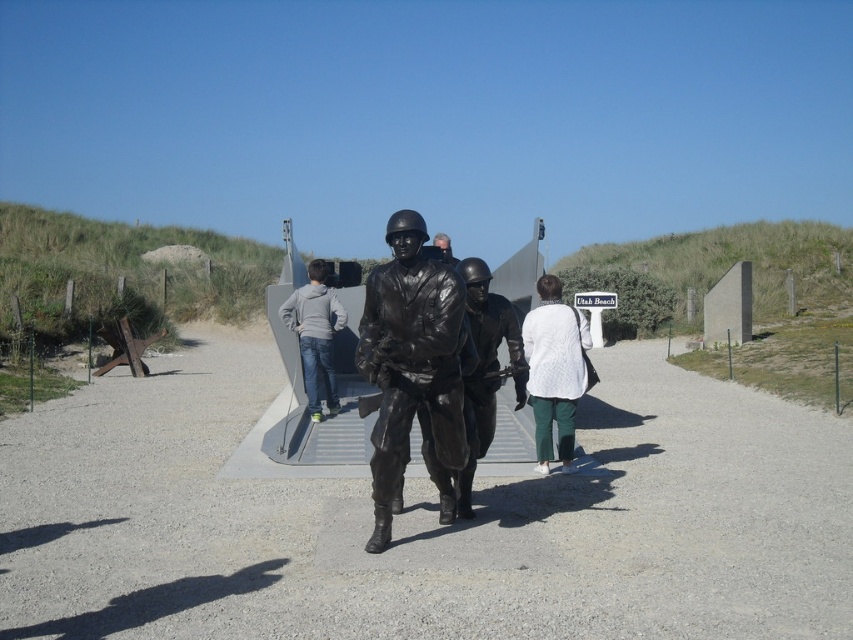
You are standing at the point marked as point (476, 387) at Utah Beach Memorial. A tour guide asks you to walk 3 meters forward from your current position. After moving, will you still be within the memorial grounds?

The point (476, 387) is 6.10 meters away from the viewer. If you walk 3 meters forward from this point, you will still be within the memorial grounds as you are still 3.1 meters away from the original viewer position, which is likely still within the memorial area.

You are a visitor at Utah Beach Memorial and notice the shiny black statue at center and the matte black helmet at center. Which object is closer to you based on their positions?

The shiny black statue at center is closer to you because it is positioned in front of the matte black helmet at center.